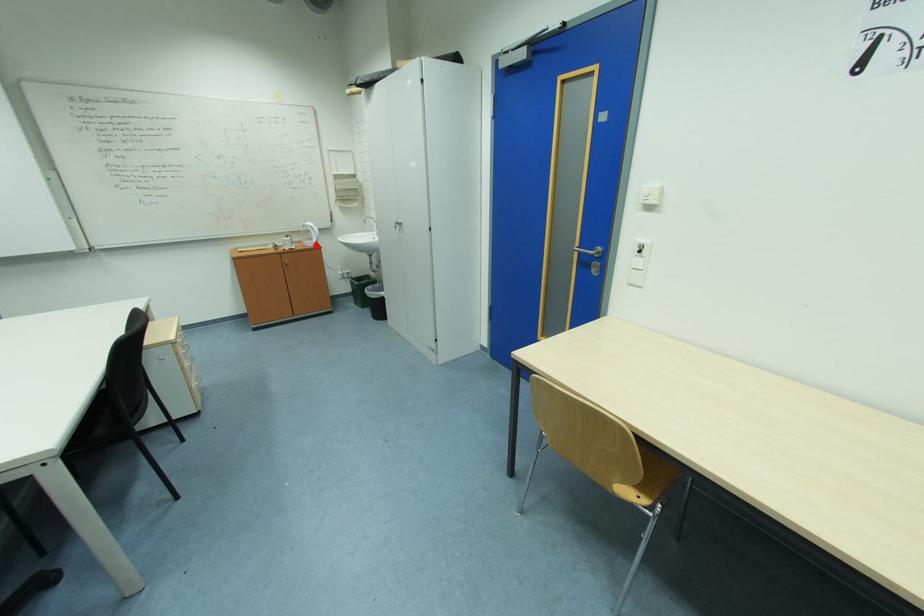
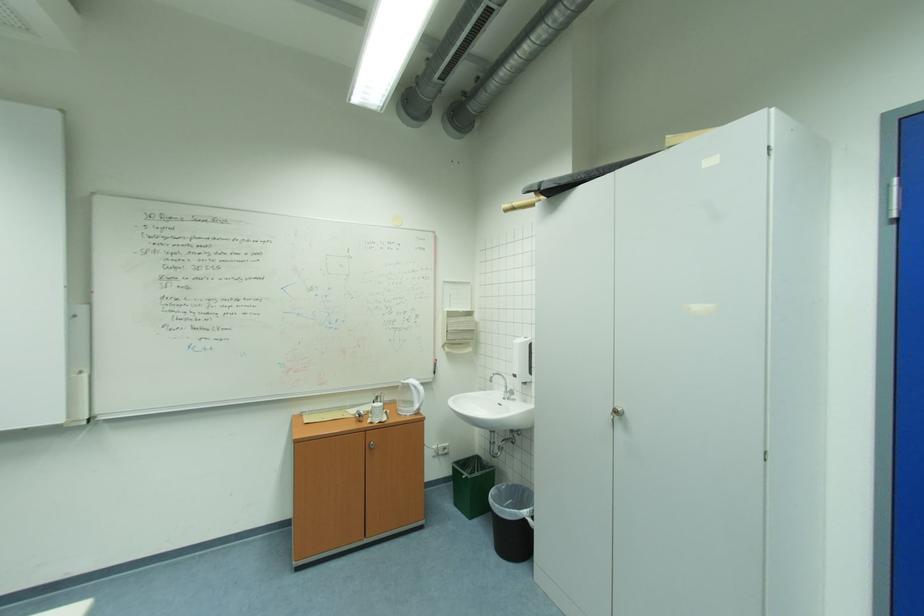
Question: I am providing you with two images of the same scene from different viewpoints. In image1, a red point is highlighted. Considering the same 3D point in image2, which of the following is correct?

Choices:
 (A) It is closer
 (B) It is farther

Answer: (B)